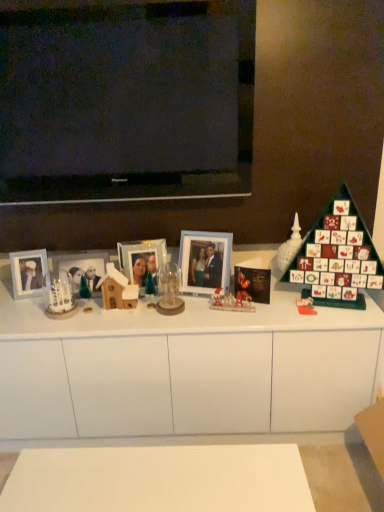
This screenshot has height=512, width=384. Identify the location of vacant space that is to the left of clear glass ornament at center, positioned as the fourth toy in right-to-left order. (134, 312).